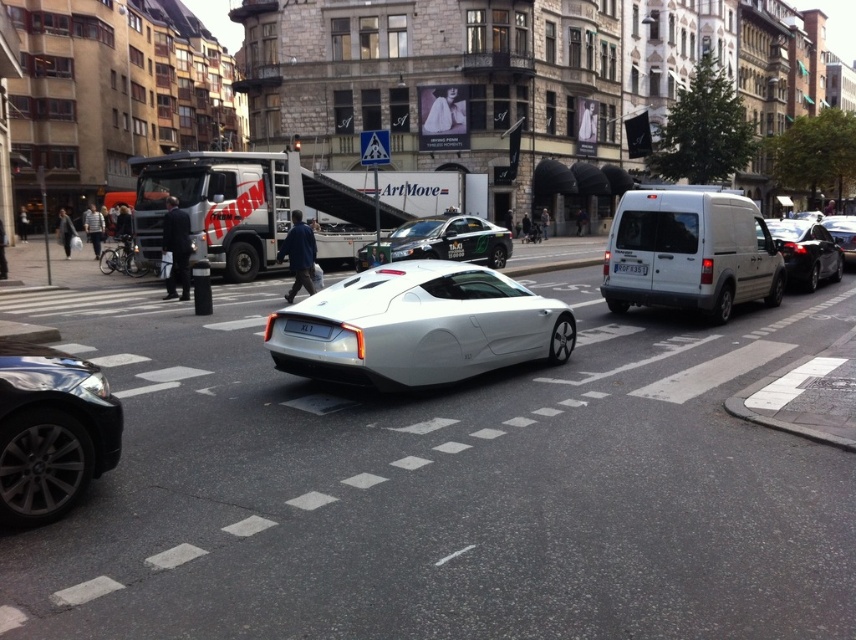
You are standing at the center of the scene. Which object is located at the point with coordinates (x=806, y=252)?

The point at (x=806, y=252) corresponds to the shiny black car at right.

You are standing on the sidewalk in the scene and want to cross the street to reach a store located behind the shiny black car at right. Can you safely cross the street to get to the store without moving any vehicles?

The shiny black car at right is 14.53 meters away from the viewer. Since the car is parked and the distance is considerable, you can safely cross the street to reach the store behind the shiny black car at right without needing to move any vehicles.

You are a pedestrian standing at the crosswalk and see the white matte van at right and the metallic silver car at center. Which vehicle is closer to the right side of the street?

The white matte van at right is closer to the right side of the street because it is positioned to the right of the metallic silver car at center.